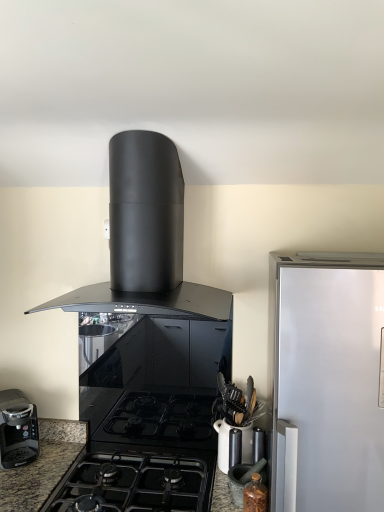
The height and width of the screenshot is (512, 384). What do you see at coordinates (135, 484) in the screenshot? I see `black matte/glossy gas stove at center` at bounding box center [135, 484].

This screenshot has height=512, width=384. Describe the element at coordinates (17, 430) in the screenshot. I see `black plastic coffee maker at lower left, marked as the fourth kitchen appliance in a right-to-left arrangement` at that location.

The height and width of the screenshot is (512, 384). What do you see at coordinates (145, 238) in the screenshot?
I see `black matte range hood at upper center, arranged as the second kitchen appliance when viewed from the left` at bounding box center [145, 238].

You are a GUI agent. You are given a task and a screenshot of the screen. Output one action in this format:
    pyautogui.click(x=<x>, y=<y>)
    Task: Click on the black matte range hood at upper center, which ranks as the 3th kitchen appliance in right-to-left order
    This screenshot has height=512, width=384.
    Given the screenshot: What is the action you would take?
    pyautogui.click(x=145, y=238)

Find the location of a particular element. This screenshot has width=384, height=512. black matte/glossy gas stove at center is located at coordinates (135, 484).

Which is farther from the camera, (x=144, y=198) or (x=265, y=476)?

The point (x=144, y=198) is farther from the camera.

Is black matte range hood at upper center, the first kitchen appliance from the top, not close to translucent glass jar at lower right?

No, black matte range hood at upper center, the first kitchen appliance from the top, is in close proximity to translucent glass jar at lower right.

Who is shorter, black matte range hood at upper center, which ranks as the 3th kitchen appliance in right-to-left order, or translucent glass jar at lower right?

Standing shorter between the two is translucent glass jar at lower right.

How different are the orientations of black matte range hood at upper center, which ranks as the 3th kitchen appliance in right-to-left order, and translucent glass jar at lower right in degrees?

black matte range hood at upper center, which ranks as the 3th kitchen appliance in right-to-left order, and translucent glass jar at lower right are facing 3.89 degrees away from each other.

From a real-world perspective, between black plastic coffee maker at lower left, arranged as the 2th kitchen appliance when viewed from the top, and black matte range hood at upper center, placed as the 4th kitchen appliance when sorted from bottom to top, who is vertically lower?

black plastic coffee maker at lower left, arranged as the 2th kitchen appliance when viewed from the top, is physically lower.

Considering the sizes of black plastic coffee maker at lower left, which is the 3th kitchen appliance from bottom to top, and black matte range hood at upper center, placed as the 4th kitchen appliance when sorted from bottom to top, in the image, is black plastic coffee maker at lower left, which is the 3th kitchen appliance from bottom to top, taller or shorter than black matte range hood at upper center, placed as the 4th kitchen appliance when sorted from bottom to top,?

Considering their sizes, black plastic coffee maker at lower left, which is the 3th kitchen appliance from bottom to top, has less height than black matte range hood at upper center, placed as the 4th kitchen appliance when sorted from bottom to top.

In terms of width, does black plastic coffee maker at lower left, which appears as the first kitchen appliance when viewed from the left, look wider or thinner when compared to black matte range hood at upper center, which ranks as the 3th kitchen appliance in right-to-left order?

In the image, black plastic coffee maker at lower left, which appears as the first kitchen appliance when viewed from the left, appears to be more narrow than black matte range hood at upper center, which ranks as the 3th kitchen appliance in right-to-left order.

Which object is positioned more to the right, black plastic coffee maker at lower left, which appears as the first kitchen appliance when viewed from the left, or black matte range hood at upper center, which ranks as the 3th kitchen appliance in right-to-left order?

From the viewer's perspective, black matte range hood at upper center, which ranks as the 3th kitchen appliance in right-to-left order, appears more on the right side.

Looking at this image, from a real-world perspective, who is located higher, matte black mortar and pestle at lower right, the third kitchen appliance when ordered from top to bottom, or brown glass jar at lower right, marked as the fourth kitchen appliance in a top-to-bottom arrangement?

matte black mortar and pestle at lower right, the third kitchen appliance when ordered from top to bottom.

How many degrees apart are the facing directions of matte black mortar and pestle at lower right, the third kitchen appliance when ordered from top to bottom, and brown glass jar at lower right, the first kitchen appliance in the bottom-to-top sequence?

They differ by 0.000755 degrees in their facing directions.

Considering the sizes of matte black mortar and pestle at lower right, the third kitchen appliance when ordered from top to bottom, and brown glass jar at lower right, the first kitchen appliance in the bottom-to-top sequence, in the image, is matte black mortar and pestle at lower right, the third kitchen appliance when ordered from top to bottom, wider or thinner than brown glass jar at lower right, the first kitchen appliance in the bottom-to-top sequence,?

Clearly, matte black mortar and pestle at lower right, the third kitchen appliance when ordered from top to bottom, has more width compared to brown glass jar at lower right, the first kitchen appliance in the bottom-to-top sequence.

Is matte black mortar and pestle at lower right, which is counted as the second kitchen appliance, starting from the bottom, located outside brown glass jar at lower right, the first kitchen appliance in the bottom-to-top sequence?

Indeed, matte black mortar and pestle at lower right, which is counted as the second kitchen appliance, starting from the bottom, is completely outside brown glass jar at lower right, the first kitchen appliance in the bottom-to-top sequence.

Could you measure the distance between black plastic coffee maker at lower left, which appears as the first kitchen appliance when viewed from the left, and black matte/glossy gas stove at center?

black plastic coffee maker at lower left, which appears as the first kitchen appliance when viewed from the left, and black matte/glossy gas stove at center are 16.10 inches apart from each other.

From the image's perspective, is black plastic coffee maker at lower left, which is the 3th kitchen appliance from bottom to top, located above or below black matte/glossy gas stove at center?

Based on their image positions, black plastic coffee maker at lower left, which is the 3th kitchen appliance from bottom to top, is located above black matte/glossy gas stove at center.

Does black plastic coffee maker at lower left, which is the 3th kitchen appliance from bottom to top, have a greater height compared to black matte/glossy gas stove at center?

Correct, black plastic coffee maker at lower left, which is the 3th kitchen appliance from bottom to top, is much taller as black matte/glossy gas stove at center.

This screenshot has height=512, width=384. There is a black matte/glossy gas stove at center. Identify the location of the 3rd kitchen appliance above it (from a real-world perspective). pyautogui.click(x=17, y=430).

Is black matte range hood at upper center, arranged as the second kitchen appliance when viewed from the left, looking in the opposite direction of matte black mortar and pestle at lower right, which is counted as the second kitchen appliance, starting from the bottom?

No, black matte range hood at upper center, arranged as the second kitchen appliance when viewed from the left,'s orientation is not away from matte black mortar and pestle at lower right, which is counted as the second kitchen appliance, starting from the bottom.

From the image's perspective, does black matte range hood at upper center, placed as the 4th kitchen appliance when sorted from bottom to top, appear lower than matte black mortar and pestle at lower right, the third kitchen appliance when ordered from top to bottom?

No, from the image's perspective, black matte range hood at upper center, placed as the 4th kitchen appliance when sorted from bottom to top, is not below matte black mortar and pestle at lower right, the third kitchen appliance when ordered from top to bottom.

From a real-world perspective, is black matte range hood at upper center, the first kitchen appliance from the top, physically located above or below matte black mortar and pestle at lower right, placed as the 3th kitchen appliance when sorted from left to right?

black matte range hood at upper center, the first kitchen appliance from the top, is situated higher than matte black mortar and pestle at lower right, placed as the 3th kitchen appliance when sorted from left to right, in the real world.

Is black matte range hood at upper center, placed as the 4th kitchen appliance when sorted from bottom to top, wider or thinner than matte black mortar and pestle at lower right, the third kitchen appliance when ordered from top to bottom?

Clearly, black matte range hood at upper center, placed as the 4th kitchen appliance when sorted from bottom to top, has more width compared to matte black mortar and pestle at lower right, the third kitchen appliance when ordered from top to bottom.

Locate an element on the screen. The image size is (384, 512). the 1st kitchen appliance above the translucent glass jar at lower right (from the image's perspective) is located at coordinates (255, 495).

Looking at this image, how distant is translucent glass jar at lower right from brown glass jar at lower right, the first kitchen appliance in the bottom-to-top sequence?

translucent glass jar at lower right is 3.24 inches from brown glass jar at lower right, the first kitchen appliance in the bottom-to-top sequence.

Which object is closer to the camera taking this photo, translucent glass jar at lower right or brown glass jar at lower right, acting as the 4th kitchen appliance starting from the left?

brown glass jar at lower right, acting as the 4th kitchen appliance starting from the left, is more forward.

Is translucent glass jar at lower right looking in the opposite direction of brown glass jar at lower right, acting as the 4th kitchen appliance starting from the left?

No, translucent glass jar at lower right is not facing away from brown glass jar at lower right, acting as the 4th kitchen appliance starting from the left.

From a real-world perspective, is black plastic coffee maker at lower left, arranged as the 2th kitchen appliance when viewed from the top, located beneath matte black mortar and pestle at lower right, which is counted as the second kitchen appliance, starting from the bottom?

No, from a real-world perspective, black plastic coffee maker at lower left, arranged as the 2th kitchen appliance when viewed from the top, is not below matte black mortar and pestle at lower right, which is counted as the second kitchen appliance, starting from the bottom.

Considering the relative positions of black plastic coffee maker at lower left, which is the 3th kitchen appliance from bottom to top, and matte black mortar and pestle at lower right, the third kitchen appliance when ordered from top to bottom, in the image provided, is black plastic coffee maker at lower left, which is the 3th kitchen appliance from bottom to top, behind matte black mortar and pestle at lower right, the third kitchen appliance when ordered from top to bottom,?

Yes, black plastic coffee maker at lower left, which is the 3th kitchen appliance from bottom to top, is further from the viewer.

Are black plastic coffee maker at lower left, which appears as the first kitchen appliance when viewed from the left, and matte black mortar and pestle at lower right, which is counted as the second kitchen appliance, starting from the bottom, far apart?

That's not correct — black plastic coffee maker at lower left, which appears as the first kitchen appliance when viewed from the left, is a little close to matte black mortar and pestle at lower right, which is counted as the second kitchen appliance, starting from the bottom.

The image size is (384, 512). In order to click on the 4th kitchen appliance positioned above the translucent glass jar at lower right (from a real-world perspective) in this screenshot , I will do `click(145, 238)`.

From the image's perspective, starting from the black matte range hood at upper center, the first kitchen appliance from the top, which kitchen appliance is the 1st one below? Please provide its 2D coordinates.

[(17, 430)]

Looking at the image, which one is located further to brown glass jar at lower right, the first kitchen appliance in the bottom-to-top sequence, black matte/glossy gas stove at center or matte black mortar and pestle at lower right, placed as the 2th kitchen appliance when sorted from right to left?

black matte/glossy gas stove at center lies further to brown glass jar at lower right, the first kitchen appliance in the bottom-to-top sequence, than the other object.

When comparing their distances from translucent glass jar at lower right, does matte black mortar and pestle at lower right, the third kitchen appliance when ordered from top to bottom, or black matte range hood at upper center, the first kitchen appliance from the top, seem further?

Among the two, black matte range hood at upper center, the first kitchen appliance from the top, is located further to translucent glass jar at lower right.

Estimate the real-world distances between objects in this image. Which object is further from brown glass jar at lower right, which is the 1th kitchen appliance from right to left, black plastic coffee maker at lower left, which is the 3th kitchen appliance from bottom to top, or black matte range hood at upper center, the first kitchen appliance from the top?

Based on the image, black plastic coffee maker at lower left, which is the 3th kitchen appliance from bottom to top, appears to be further to brown glass jar at lower right, which is the 1th kitchen appliance from right to left.

Looking at the image, which one is located further to matte black mortar and pestle at lower right, which is counted as the second kitchen appliance, starting from the bottom, black plastic coffee maker at lower left, arranged as the 2th kitchen appliance when viewed from the top, or brown glass jar at lower right, marked as the fourth kitchen appliance in a top-to-bottom arrangement?

Based on the image, black plastic coffee maker at lower left, arranged as the 2th kitchen appliance when viewed from the top, appears to be further to matte black mortar and pestle at lower right, which is counted as the second kitchen appliance, starting from the bottom.

From the image, which object appears to be nearer to matte black mortar and pestle at lower right, placed as the 2th kitchen appliance when sorted from right to left, translucent glass jar at lower right or brown glass jar at lower right, acting as the 4th kitchen appliance starting from the left?

The object closer to matte black mortar and pestle at lower right, placed as the 2th kitchen appliance when sorted from right to left, is translucent glass jar at lower right.

Estimate the real-world distances between objects in this image. Which object is further from black plastic coffee maker at lower left, which appears as the first kitchen appliance when viewed from the left, translucent glass jar at lower right or brown glass jar at lower right, which is the 1th kitchen appliance from right to left?

The object further to black plastic coffee maker at lower left, which appears as the first kitchen appliance when viewed from the left, is brown glass jar at lower right, which is the 1th kitchen appliance from right to left.

When comparing their distances from black plastic coffee maker at lower left, which appears as the first kitchen appliance when viewed from the left, does translucent glass jar at lower right or matte black mortar and pestle at lower right, placed as the 3th kitchen appliance when sorted from left to right, seem closer?

matte black mortar and pestle at lower right, placed as the 3th kitchen appliance when sorted from left to right, lies closer to black plastic coffee maker at lower left, which appears as the first kitchen appliance when viewed from the left, than the other object.

Considering their positions, is black matte range hood at upper center, placed as the 4th kitchen appliance when sorted from bottom to top, positioned closer to black matte/glossy gas stove at center than black plastic coffee maker at lower left, arranged as the 2th kitchen appliance when viewed from the top?

black plastic coffee maker at lower left, arranged as the 2th kitchen appliance when viewed from the top, lies closer to black matte/glossy gas stove at center than the other object.

This screenshot has height=512, width=384. What are the coordinates of `kitchen appliance situated between black matte/glossy gas stove at center and translucent glass jar at lower right from left to right` in the screenshot? It's located at (228, 443).

Where is `appliance between black matte/glossy gas stove at center and brown glass jar at lower right, which is the 1th kitchen appliance from right to left, from left to right`? appliance between black matte/glossy gas stove at center and brown glass jar at lower right, which is the 1th kitchen appliance from right to left, from left to right is located at coordinates (244, 478).

What are the coordinates of `appliance between black matte range hood at upper center, arranged as the second kitchen appliance when viewed from the left, and black matte/glossy gas stove at center, in the vertical direction` in the screenshot? It's located at (244, 478).

You are a GUI agent. You are given a task and a screenshot of the screen. Output one action in this format:
    pyautogui.click(x=<x>, y=<y>)
    Task: Click on the gas stove between black plastic coffee maker at lower left, which is the 3th kitchen appliance from bottom to top, and translucent glass jar at lower right
    
    Given the screenshot: What is the action you would take?
    pyautogui.click(x=135, y=484)